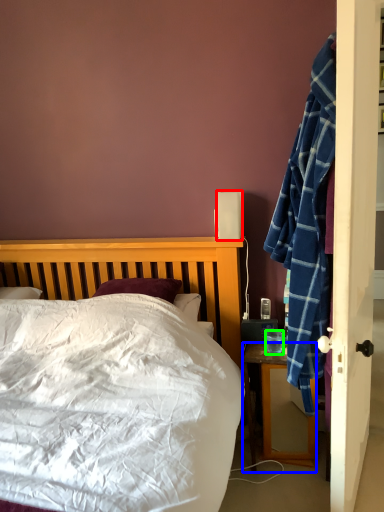
Question: Considering the real-world distances, which object is farthest from loudspeaker (highlighted by a red box)? desk (highlighted by a blue box) or coffee cup (highlighted by a green box)?

Choices:
 (A) desk
 (B) coffee cup

Answer: (A)